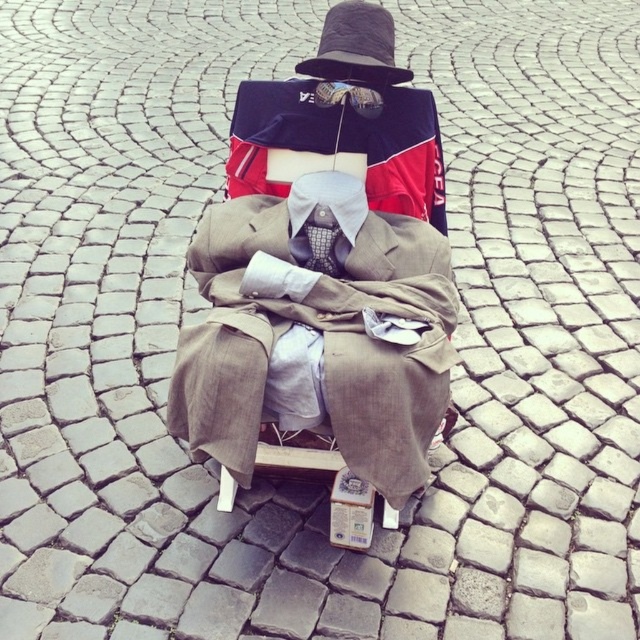
Question: Which point is closer to the camera taking this photo?

Choices:
 (A) (346, 420)
 (B) (355, 6)

Answer: (A)

Question: Which of the following is the farthest from the observer?

Choices:
 (A) (324, 205)
 (B) (228, 170)
 (C) (349, 49)
 (D) (241, 440)

Answer: (B)

Question: From the image, what is the correct spatial relationship of black felt hat at upper center in relation to silky black tie at center?

Choices:
 (A) below
 (B) above

Answer: (B)

Question: In this image, where is light brown fabric suit at center located relative to red and black jersey at center?

Choices:
 (A) right
 (B) left

Answer: (B)

Question: Which of the following is the farthest from the observer?

Choices:
 (A) (387, 144)
 (B) (348, 17)

Answer: (A)

Question: Can you confirm if red and black jersey at center is positioned to the right of black felt hat at upper center?

Choices:
 (A) no
 (B) yes

Answer: (A)